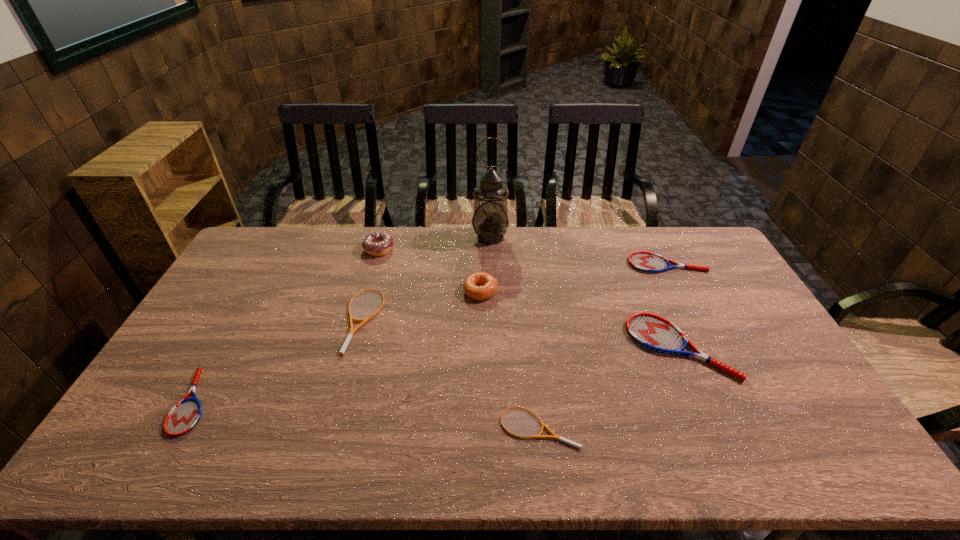
This screenshot has width=960, height=540. Find the location of `oil lamp`. oil lamp is located at coordinates (490, 221).

Find the location of `the farther doughnut`. the farther doughnut is located at coordinates (377, 243).

Where is `the left doughnut`? This screenshot has height=540, width=960. the left doughnut is located at coordinates (377, 243).

Where is `tan doughnut`? tan doughnut is located at coordinates (471, 286).

Where is `the nearer doughnut`? the nearer doughnut is located at coordinates (471, 286).

Locate an element on the screen. This screenshot has height=540, width=960. the tallest tennis racket is located at coordinates (651, 331).

I want to click on the fourth tallest object, so click(x=651, y=331).

Identify the location of the farthest tennis racket. (648, 262).

Where is `the farthest blue tennis racket`? the farthest blue tennis racket is located at coordinates (648, 262).

Locate an element on the screen. This screenshot has height=540, width=960. the fourth tennis racket from right to left is located at coordinates tap(350, 335).